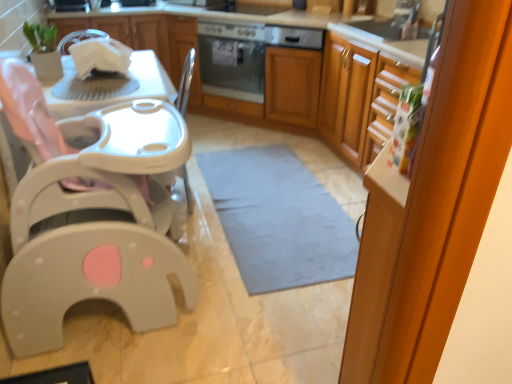
Question: From the image's perspective, is transparent glass screen door at right located beneath white glossy dishwasher at upper center?

Choices:
 (A) no
 (B) yes

Answer: (B)

Question: Does transparent glass screen door at right have a lesser width compared to white glossy dishwasher at upper center?

Choices:
 (A) yes
 (B) no

Answer: (B)

Question: Is the position of transparent glass screen door at right less distant than that of white glossy dishwasher at upper center?

Choices:
 (A) yes
 (B) no

Answer: (A)

Question: Can you confirm if transparent glass screen door at right is smaller than white glossy dishwasher at upper center?

Choices:
 (A) no
 (B) yes

Answer: (A)

Question: Is transparent glass screen door at right behind white glossy dishwasher at upper center?

Choices:
 (A) no
 (B) yes

Answer: (A)

Question: Can you confirm if transparent glass screen door at right is shorter than white glossy dishwasher at upper center?

Choices:
 (A) no
 (B) yes

Answer: (A)

Question: Is gray fabric mat at center at the right side of satin silver oven at center?

Choices:
 (A) yes
 (B) no

Answer: (A)

Question: Can you confirm if gray fabric mat at center is wider than satin silver oven at center?

Choices:
 (A) yes
 (B) no

Answer: (A)

Question: Is gray fabric mat at center to the left of satin silver oven at center from the viewer's perspective?

Choices:
 (A) yes
 (B) no

Answer: (B)

Question: From a real-world perspective, is gray fabric mat at center on top of satin silver oven at center?

Choices:
 (A) no
 (B) yes

Answer: (A)

Question: Does gray fabric mat at center have a greater height compared to satin silver oven at center?

Choices:
 (A) yes
 (B) no

Answer: (B)

Question: Does gray fabric mat at center turn towards satin silver oven at center?

Choices:
 (A) no
 (B) yes

Answer: (A)

Question: Is white glossy cabinet at upper left, the 2th cabinetry from the right, facing away from satin silver oven at center?

Choices:
 (A) no
 (B) yes

Answer: (A)